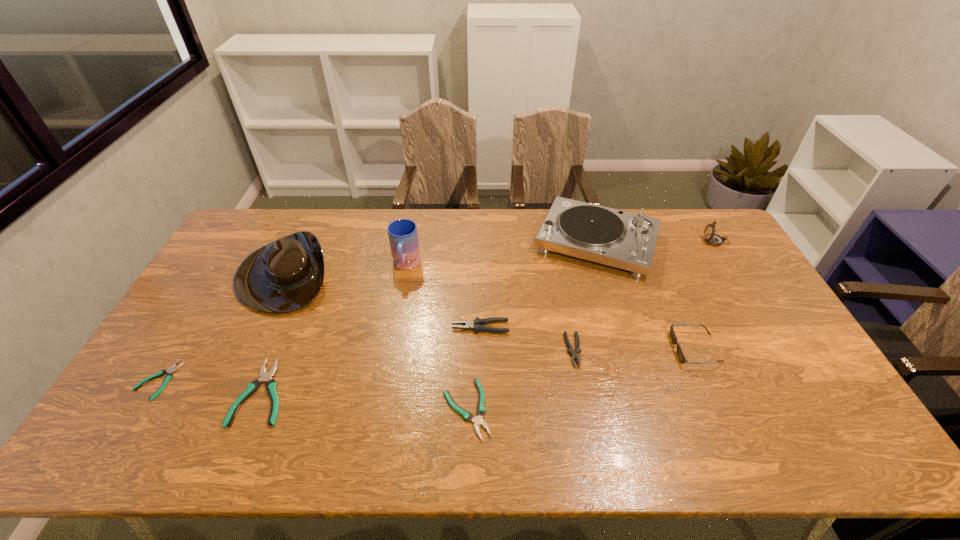
Identify the location of vacant region that satisfies the following two spatial constraints: 1. on the front side of the rightmost teal pliers; 2. on the left side of the second teal pliers from left to right. This screenshot has height=540, width=960. (257, 408).